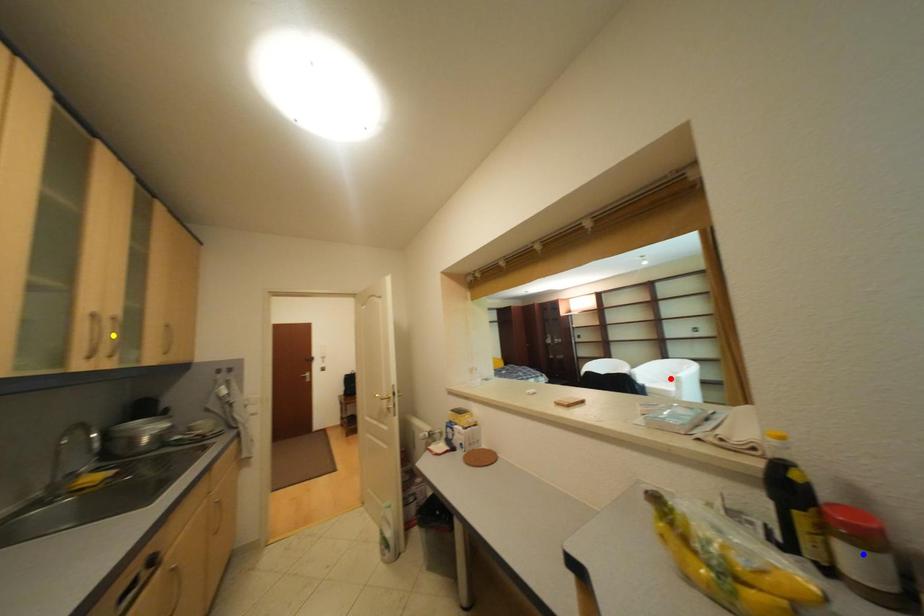
Order these from nearest to farthest:
yellow point, blue point, red point

blue point → yellow point → red point